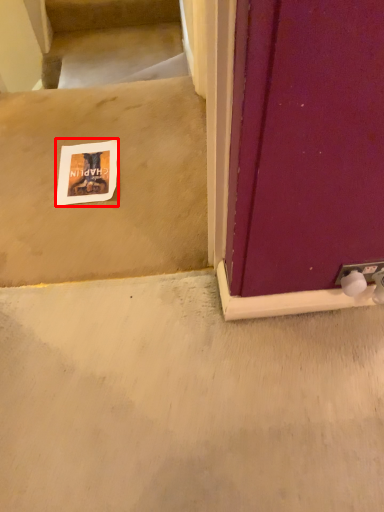
Question: Considering the relative positions of postcard (annotated by the red box) and stairwell in the image provided, where is postcard (annotated by the red box) located with respect to the staircase?

Choices:
 (A) right
 (B) left

Answer: (A)